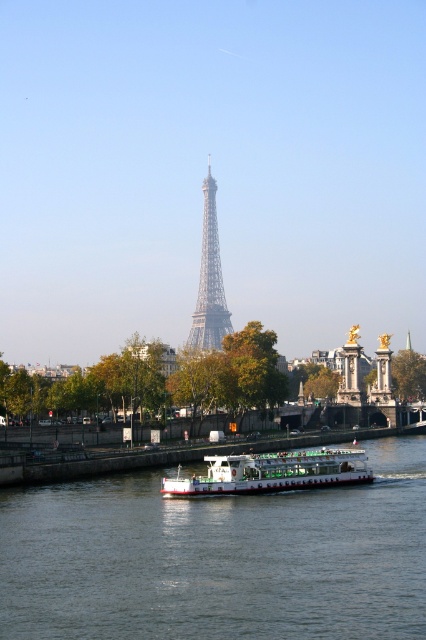
Question: Which object appears closest to the camera in this image?

Choices:
 (A) green smooth water at center
 (B) white matte boat at center
 (C) shiny metallic eiffel tower at center

Answer: (A)

Question: Which point is closer to the camera?

Choices:
 (A) white matte boat at center
 (B) green smooth water at center

Answer: (B)

Question: Which object appears closest to the camera in this image?

Choices:
 (A) green smooth water at center
 (B) shiny metallic eiffel tower at center

Answer: (A)

Question: Does green smooth water at center appear on the right side of shiny metallic eiffel tower at center?

Choices:
 (A) no
 (B) yes

Answer: (B)

Question: Is white matte boat at center to the right of shiny metallic eiffel tower at center from the viewer's perspective?

Choices:
 (A) yes
 (B) no

Answer: (A)

Question: Does white matte boat at center have a larger size compared to shiny metallic eiffel tower at center?

Choices:
 (A) yes
 (B) no

Answer: (B)